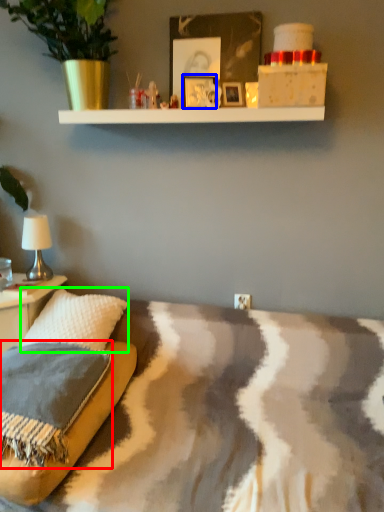
Question: Estimate the real-world distances between objects in this image. Which object is farther from pillow (highlighted by a red box), picture frame (highlighted by a blue box) or throw pillow (highlighted by a green box)?

Choices:
 (A) picture frame
 (B) throw pillow

Answer: (A)